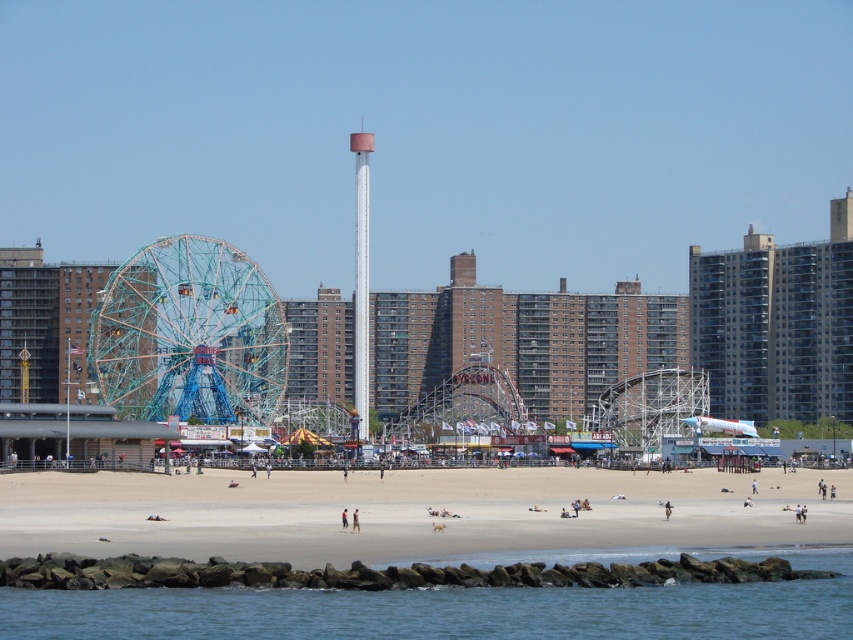
You are standing at the Ferris wheel on the left and want to walk to the point marked at coordinates point [247,513] and point [99,324]. Which point is closer to you?

Point [247,513] is in front of point [99,324], so you are closer to point [247,513].

You are standing on the beige sand beach at center and want to reach the blue water at lower center. Which direction should you move to get closer to the water?

You should move forward because the beige sand beach at center is further away from you than the blue water at lower center, so moving towards the lower part of the image will bring you closer to the water.